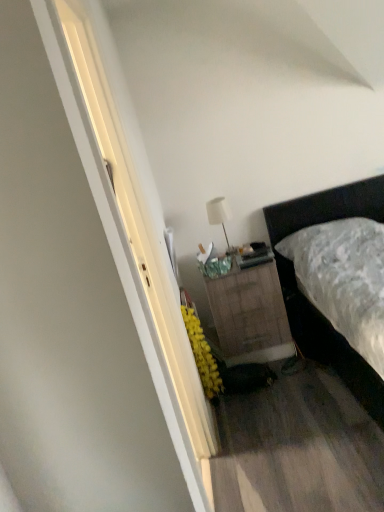
What do you see at coordinates (248, 315) in the screenshot? I see `burlap-textured nightstand at center` at bounding box center [248, 315].

What is the approximate height of white matte table lamp at upper center?

It is 16.25 inches.

Find the location of a particular element. This screenshot has height=512, width=384. burlap-textured nightstand at center is located at coordinates (248, 315).

Does dark brown leather bed at right have a greater width compared to white matte table lamp at upper center?

Yes.

From a real-world perspective, between dark brown leather bed at right and white matte table lamp at upper center, who is vertically lower?

dark brown leather bed at right is physically lower.

Considering the relative sizes of dark brown leather bed at right and white matte table lamp at upper center in the image provided, is dark brown leather bed at right taller than white matte table lamp at upper center?

Correct, dark brown leather bed at right is much taller as white matte table lamp at upper center.

Could white matte table lamp at upper center be considered to be inside dark brown leather bed at right?

No, dark brown leather bed at right does not contain white matte table lamp at upper center.

From the image's perspective, between white matte table lamp at upper center and dark brown leather bed at right, which one is located above?

white matte table lamp at upper center appears higher in the image.

Between white matte table lamp at upper center and dark brown leather bed at right, which one has more height?

dark brown leather bed at right is taller.

Consider the image. Would you consider white matte table lamp at upper center to be distant from dark brown leather bed at right?

white matte table lamp at upper center is near dark brown leather bed at right, not far away.

Based on the photo, does white matte table lamp at upper center appear on the right side of dark brown leather bed at right?

No, white matte table lamp at upper center is not to the right of dark brown leather bed at right.

Measure the distance between burlap-textured nightstand at center and dark brown leather bed at right.

burlap-textured nightstand at center and dark brown leather bed at right are 14.66 inches apart.

Visually, is burlap-textured nightstand at center positioned to the left or to the right of dark brown leather bed at right?

Clearly, burlap-textured nightstand at center is on the left of dark brown leather bed at right in the image.

Is dark brown leather bed at right a part of burlap-textured nightstand at center?

Actually, dark brown leather bed at right is outside burlap-textured nightstand at center.

Can you see burlap-textured nightstand at center touching dark brown leather bed at right?

No, burlap-textured nightstand at center is not beside dark brown leather bed at right.

Who is taller, burlap-textured nightstand at center or white matte table lamp at upper center?

Standing taller between the two is burlap-textured nightstand at center.

Which is closer to the camera, (255, 356) or (223, 209)?

Point (255, 356) is closer to the camera than point (223, 209).

I want to click on table lamp on the left of burlap-textured nightstand at center, so click(x=220, y=217).

How different are the orientations of burlap-textured nightstand at center and white matte table lamp at upper center in degrees?

The facing directions of burlap-textured nightstand at center and white matte table lamp at upper center are 0.0014 degrees apart.

Is dark brown leather bed at right positioned with its back to burlap-textured nightstand at center?

dark brown leather bed at right is not turned away from burlap-textured nightstand at center.

From the image's perspective, who appears lower, dark brown leather bed at right or burlap-textured nightstand at center?

burlap-textured nightstand at center is shown below in the image.

From a real-world perspective, is dark brown leather bed at right beneath burlap-textured nightstand at center?

No, from a real-world perspective, dark brown leather bed at right is not below burlap-textured nightstand at center.

Looking at the image, does dark brown leather bed at right seem bigger or smaller compared to burlap-textured nightstand at center?

dark brown leather bed at right is bigger than burlap-textured nightstand at center.

From a real-world perspective, is white matte table lamp at upper center below burlap-textured nightstand at center?

Actually, white matte table lamp at upper center is physically above burlap-textured nightstand at center in the real world.

From the image's perspective, which is below, white matte table lamp at upper center or burlap-textured nightstand at center?

burlap-textured nightstand at center is shown below in the image.

Which is more to the right, white matte table lamp at upper center or burlap-textured nightstand at center?

burlap-textured nightstand at center is more to the right.

Considering the sizes of objects white matte table lamp at upper center and burlap-textured nightstand at center in the image provided, who is wider, white matte table lamp at upper center or burlap-textured nightstand at center?

burlap-textured nightstand at center is wider.

At what (x,y) coordinates should I click in order to perform the action: click on bed directly beneath the white matte table lamp at upper center (from a real-world perspective). Please return your answer as a coordinate pair (x, y). Image resolution: width=384 pixels, height=512 pixels. Looking at the image, I should click on (293, 264).

You are a GUI agent. You are given a task and a screenshot of the screen. Output one action in this format:
    pyautogui.click(x=<x>, y=<y>)
    Task: Click on the table lamp behind the dark brown leather bed at right
    
    Given the screenshot: What is the action you would take?
    pyautogui.click(x=220, y=217)

Which object lies nearer to the anchor point dark brown leather bed at right, burlap-textured nightstand at center or white matte table lamp at upper center?

burlap-textured nightstand at center.

Estimate the real-world distances between objects in this image. Which object is closer to dark brown leather bed at right, white matte table lamp at upper center or burlap-textured nightstand at center?

Based on the image, burlap-textured nightstand at center appears to be nearer to dark brown leather bed at right.

Looking at this image, looking at the image, which one is located further to white matte table lamp at upper center, dark brown leather bed at right or burlap-textured nightstand at center?

dark brown leather bed at right.

Estimate the real-world distances between objects in this image. Which object is further from burlap-textured nightstand at center, white matte table lamp at upper center or dark brown leather bed at right?

white matte table lamp at upper center lies further to burlap-textured nightstand at center than the other object.

Considering their positions, is dark brown leather bed at right positioned closer to burlap-textured nightstand at center than white matte table lamp at upper center?

dark brown leather bed at right.

Based on their spatial positions, is burlap-textured nightstand at center or dark brown leather bed at right closer to white matte table lamp at upper center?

burlap-textured nightstand at center lies closer to white matte table lamp at upper center than the other object.

Identify the location of nightstand located between dark brown leather bed at right and white matte table lamp at upper center in the depth direction. (248, 315).